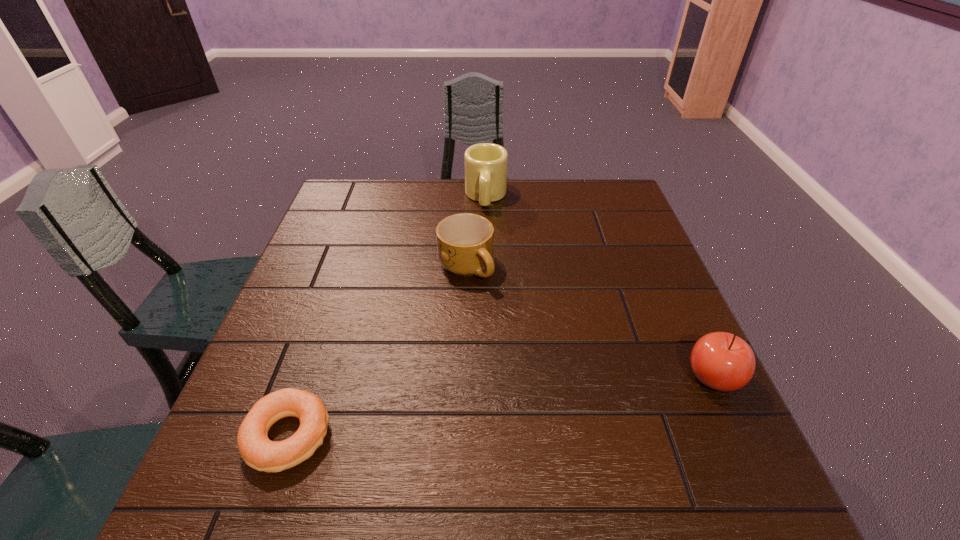
You are a GUI agent. You are given a task and a screenshot of the screen. Output one action in this format:
    pyautogui.click(x=<x>, y=<y>)
    Task: Click on the free spot between the leftmost object and the farthest object
    The height and width of the screenshot is (540, 960).
    Given the screenshot: What is the action you would take?
    pyautogui.click(x=387, y=316)

Locate an element on the screen. vacant space that is in between the bagel and the third nearest object is located at coordinates (377, 352).

The image size is (960, 540). Identify the location of free space between the second shortest object and the leftmost object. (377, 352).

Locate an element on the screen. This screenshot has height=540, width=960. vacant space that is in between the taller mug and the apple is located at coordinates (599, 287).

You are a GUI agent. You are given a task and a screenshot of the screen. Output one action in this format:
    pyautogui.click(x=<x>, y=<y>)
    Task: Click on the object that stands as the closest to the shortest object
    
    Given the screenshot: What is the action you would take?
    pyautogui.click(x=465, y=242)

Where is `object identified as the closest to the farthest object`? The width and height of the screenshot is (960, 540). object identified as the closest to the farthest object is located at coordinates (465, 242).

You are a GUI agent. You are given a task and a screenshot of the screen. Output one action in this format:
    pyautogui.click(x=<x>, y=<y>)
    Task: Click on the free space in the image that satisfies the following two spatial constraints: 1. on the back side of the shortest object; 2. on the left side of the rightmost object
    
    Given the screenshot: What is the action you would take?
    pyautogui.click(x=309, y=377)

Identify the location of free point that satisfies the following two spatial constraints: 1. on the back side of the leftmost object; 2. on the left side of the farther mug. Image resolution: width=960 pixels, height=540 pixels. (371, 197).

Locate an element on the screen. The width and height of the screenshot is (960, 540). vacant space that satisfies the following two spatial constraints: 1. on the back side of the farthest object; 2. on the left side of the leftmost object is located at coordinates (371, 197).

Locate an element on the screen. vacant space that satisfies the following two spatial constraints: 1. on the front side of the rightmost object; 2. on the right side of the farther mug is located at coordinates pos(490,377).